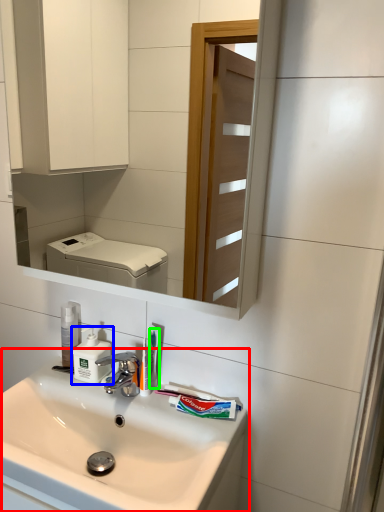
Question: Considering the real-world distances, which object is farthest from sink (highlighted by a red box)? soap dispenser (highlighted by a blue box) or toothbrush (highlighted by a green box)?

Choices:
 (A) soap dispenser
 (B) toothbrush

Answer: (B)